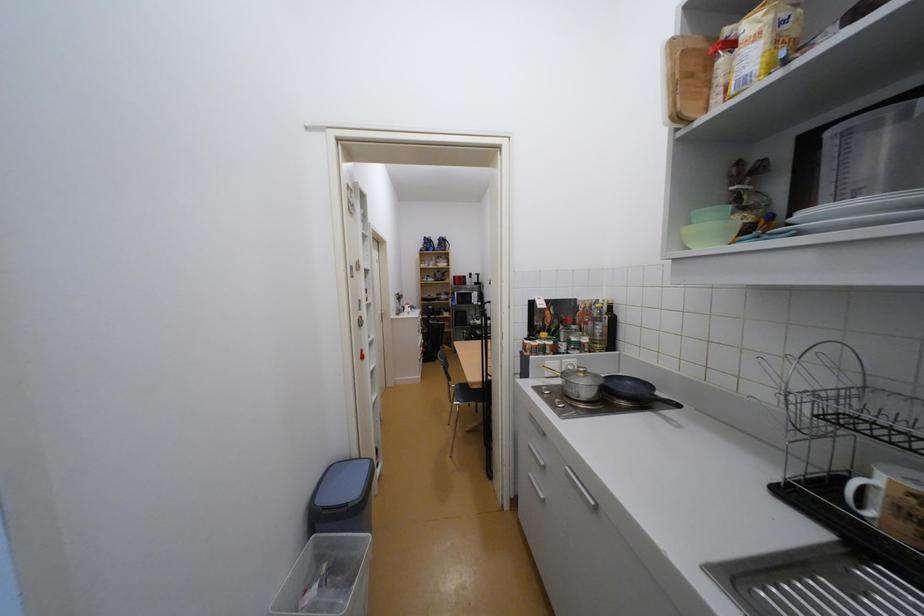
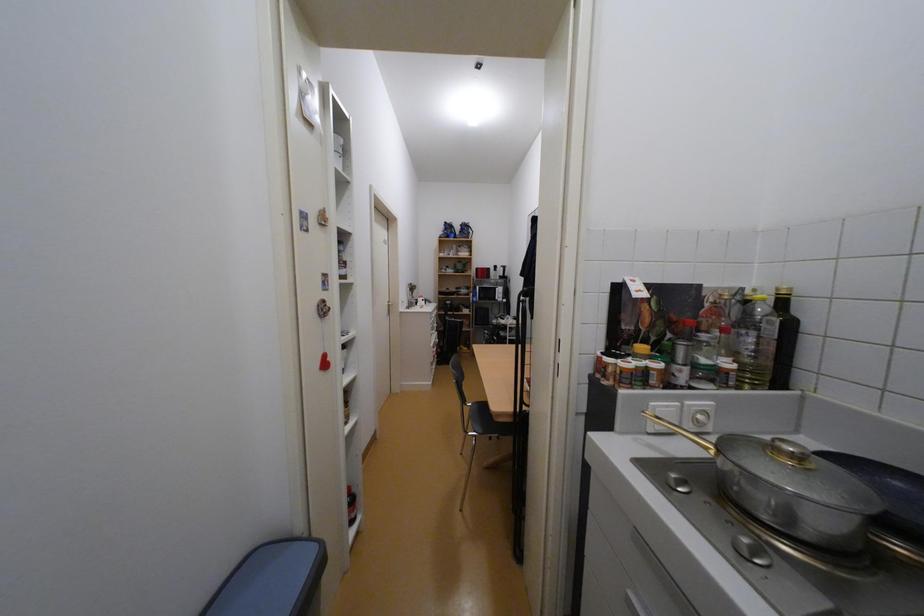
Question: The first image is from the beginning of the video and the second image is from the end. How did the camera likely rotate when shooting the video?

Choices:
 (A) Left
 (B) Right
 (C) Up
 (D) Down

Answer: (A)